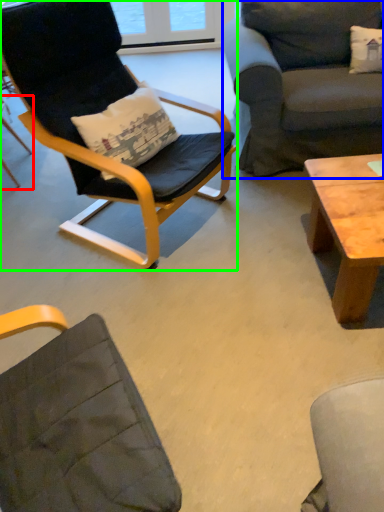
Question: Considering the real-world distances, which object is farthest from chair (highlighted by a red box)? studio couch (highlighted by a blue box) or chair (highlighted by a green box)?

Choices:
 (A) studio couch
 (B) chair

Answer: (A)